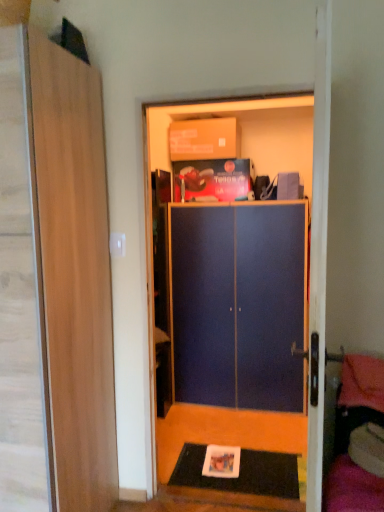
Question: From the image's perspective, is blue matte cabinet at center above matte cardboard box at upper center?

Choices:
 (A) yes
 (B) no

Answer: (B)

Question: Are blue matte cabinet at center and matte cardboard box at upper center beside each other?

Choices:
 (A) yes
 (B) no

Answer: (B)

Question: Considering the relative sizes of blue matte cabinet at center and matte cardboard box at upper center in the image provided, is blue matte cabinet at center shorter than matte cardboard box at upper center?

Choices:
 (A) no
 (B) yes

Answer: (A)

Question: Considering the relative sizes of blue matte cabinet at center and matte cardboard box at upper center in the image provided, is blue matte cabinet at center bigger than matte cardboard box at upper center?

Choices:
 (A) yes
 (B) no

Answer: (A)

Question: Is blue matte cabinet at center oriented towards matte cardboard box at upper center?

Choices:
 (A) no
 (B) yes

Answer: (A)

Question: Is wooden door at left bigger or smaller than blue matte cabinet at center?

Choices:
 (A) big
 (B) small

Answer: (A)

Question: In terms of height, does wooden door at left look taller or shorter compared to blue matte cabinet at center?

Choices:
 (A) short
 (B) tall

Answer: (B)

Question: Does point (44, 131) appear closer or farther from the camera than point (291, 391)?

Choices:
 (A) farther
 (B) closer

Answer: (B)

Question: Would you say wooden door at left is inside or outside blue matte cabinet at center?

Choices:
 (A) inside
 (B) outside

Answer: (B)

Question: From the image's perspective, is matte cardboard box at upper center above or below blue matte cabinet at center?

Choices:
 (A) below
 (B) above

Answer: (B)

Question: In terms of height, does matte cardboard box at upper center look taller or shorter compared to blue matte cabinet at center?

Choices:
 (A) short
 (B) tall

Answer: (A)

Question: Looking at the image, does matte cardboard box at upper center seem bigger or smaller compared to blue matte cabinet at center?

Choices:
 (A) small
 (B) big

Answer: (A)

Question: In the image, is matte cardboard box at upper center positioned in front of or behind blue matte cabinet at center?

Choices:
 (A) front
 (B) behind

Answer: (B)

Question: Looking at their shapes, would you say black rubber doormat at lower center is wider or thinner than blue matte cabinet at center?

Choices:
 (A) thin
 (B) wide

Answer: (B)

Question: From a real-world perspective, is black rubber doormat at lower center positioned above or below blue matte cabinet at center?

Choices:
 (A) below
 (B) above

Answer: (A)